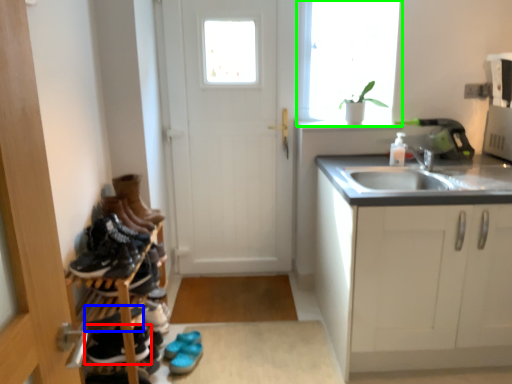
Question: Considering the real-world distances, which object is closest to footwear (highlighted by a red box)? shoe (highlighted by a blue box) or window (highlighted by a green box).

Choices:
 (A) shoe
 (B) window

Answer: (A)